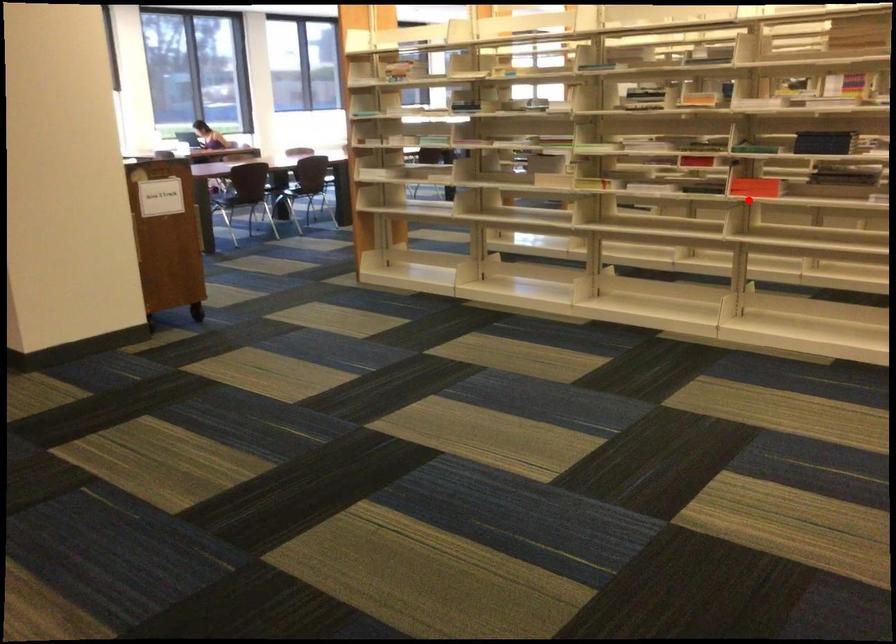
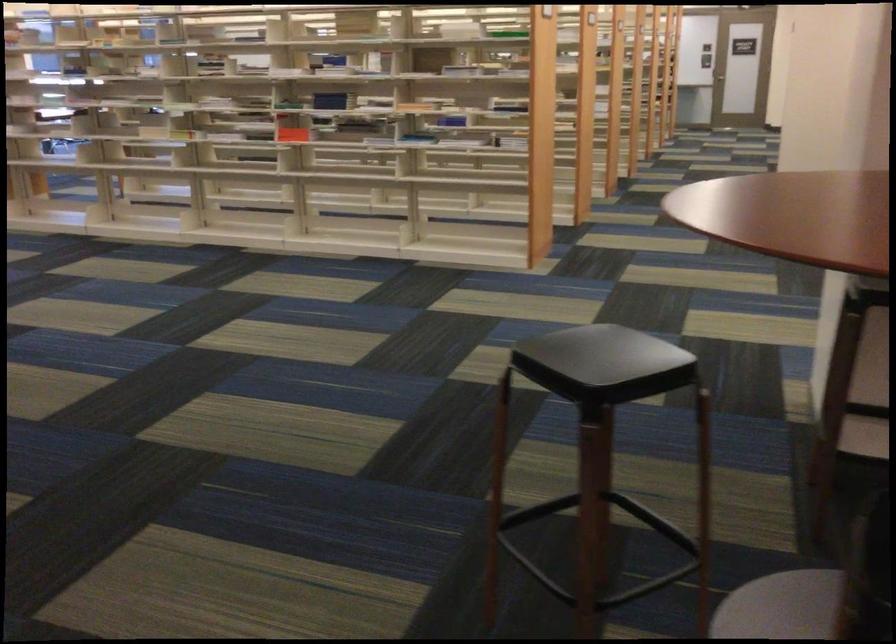
Locate, in the second image, the point that corresponds to the highlighted location in the first image.

(291, 131)